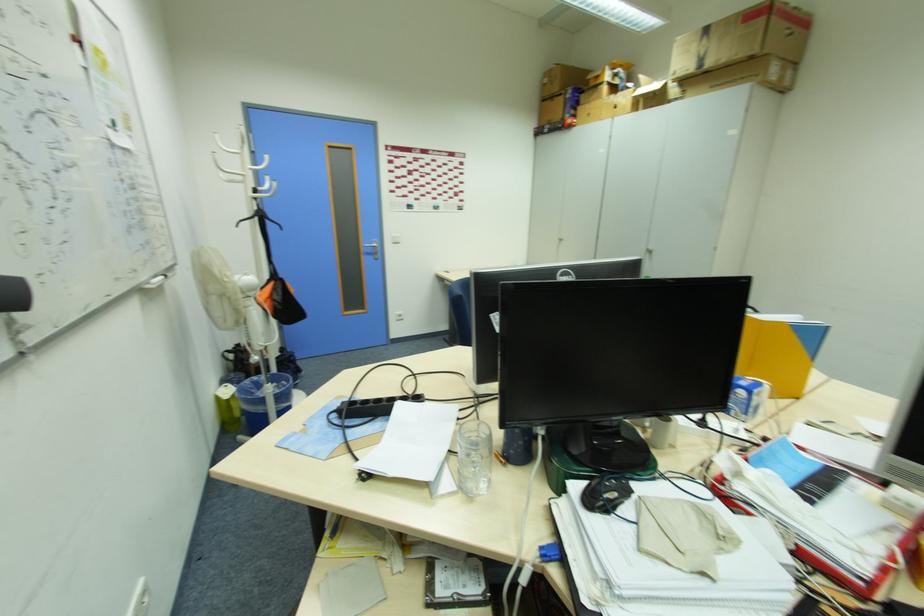
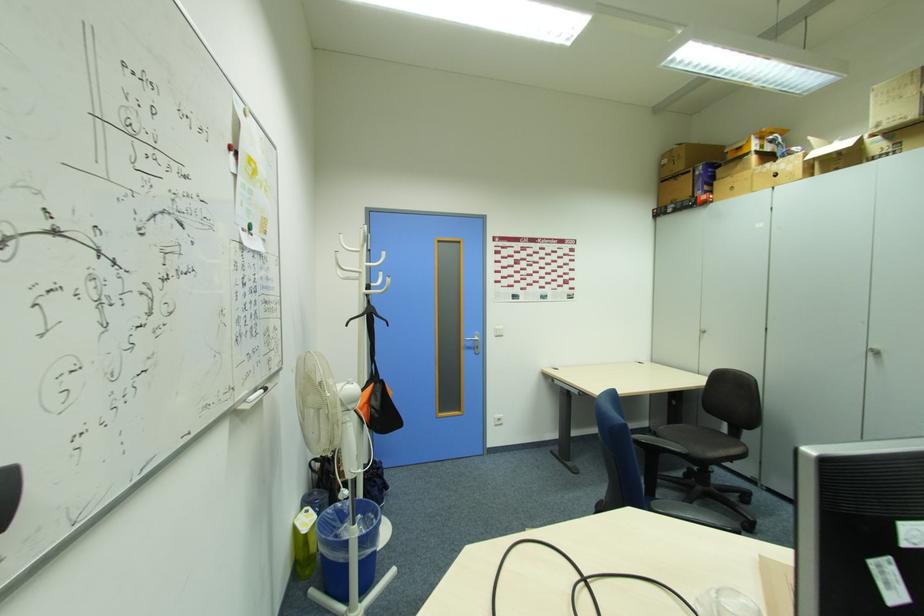
Where in the second image is the point corresponding to the point at 685,71 from the first image?

(889, 123)